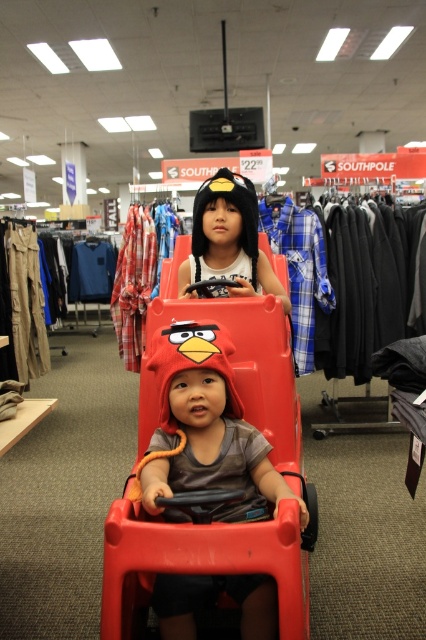
Question: Does matte plastic toy car at center appear under matte black hat at center?

Choices:
 (A) no
 (B) yes

Answer: (B)

Question: Does matte plastic toy car at center appear over matte black hat at center?

Choices:
 (A) no
 (B) yes

Answer: (A)

Question: Among these points, which one is nearest to the camera?

Choices:
 (A) (284, 358)
 (B) (204, 182)

Answer: (A)

Question: In this image, where is matte plastic toy car at center located relative to matte black hat at center?

Choices:
 (A) below
 (B) above

Answer: (A)

Question: Among these points, which one is farthest from the camera?

Choices:
 (A) (215, 289)
 (B) (138, 540)

Answer: (A)

Question: Which of the following is the closest to the observer?

Choices:
 (A) (158, 410)
 (B) (239, 256)

Answer: (A)